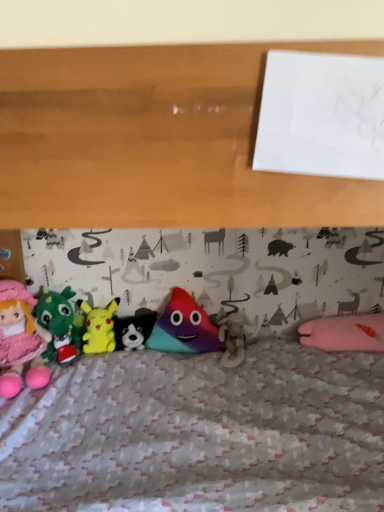
Question: Relative to white plush dog at center, arranged as the third toy when viewed from the right, is velvet green dragon at left, which appears as the 2th toy when viewed from the left, in front or behind?

Choices:
 (A) behind
 (B) front

Answer: (B)

Question: In terms of height, does velvet green dragon at left, which appears as the 2th toy when viewed from the left, look taller or shorter compared to white plush dog at center, marked as the fourth toy in a left-to-right arrangement?

Choices:
 (A) short
 (B) tall

Answer: (B)

Question: Estimate the real-world distances between objects in this image. Which object is closer to the fluffy white teddy bear at center, which ranks as the 6th toy in left-to-right order?

Choices:
 (A) yellow plush toy at center, acting as the fourth toy starting from the right
 (B) white plush dog at center, arranged as the third toy when viewed from the right
 (C) matte pink plush doll at left, which is counted as the 6th toy, starting from the right
 (D) multicolored plush toy at center, which is the second toy from right to left
 (E) velvet green dragon at left, which appears as the 2th toy when viewed from the left

Answer: (D)

Question: Which is nearer to the white plush dog at center, marked as the fourth toy in a left-to-right arrangement?

Choices:
 (A) matte pink plush doll at left, which is counted as the first toy, starting from the left
 (B) fluffy white teddy bear at center, which ranks as the 6th toy in left-to-right order
 (C) yellow plush toy at center, acting as the fourth toy starting from the right
 (D) velvet green dragon at left, which appears as the 2th toy when viewed from the left
 (E) multicolored plush toy at center, which appears as the 5th toy when viewed from the left

Answer: (C)